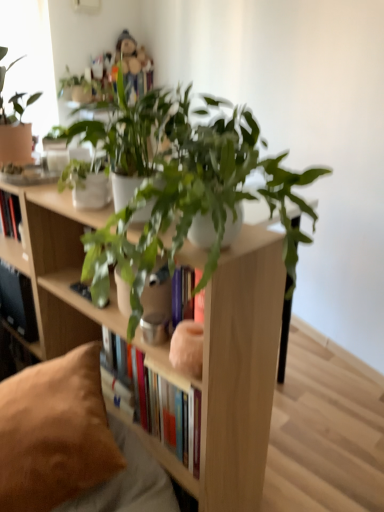
Question: From a real-world perspective, is black matte shelf at lower left located higher than green matte plant at center, the second houseplant from the front?

Choices:
 (A) no
 (B) yes

Answer: (A)

Question: Can you confirm if black matte shelf at lower left is shorter than green matte plant at center, the second houseplant from the front?

Choices:
 (A) yes
 (B) no

Answer: (A)

Question: Considering the relative sizes of black matte shelf at lower left and green matte plant at center, which is counted as the 1th houseplant, starting from the back, in the image provided, is black matte shelf at lower left bigger than green matte plant at center, which is counted as the 1th houseplant, starting from the back,?

Choices:
 (A) yes
 (B) no

Answer: (B)

Question: From the image's perspective, would you say black matte shelf at lower left is shown under green matte plant at center, the second houseplant from the front?

Choices:
 (A) yes
 (B) no

Answer: (A)

Question: Is black matte shelf at lower left far away from green matte plant at center, which is counted as the 1th houseplant, starting from the back?

Choices:
 (A) no
 (B) yes

Answer: (A)

Question: Considering the relative positions of matte white bookcase at center and black matte shelf at lower left in the image provided, is matte white bookcase at center to the left or to the right of black matte shelf at lower left?

Choices:
 (A) left
 (B) right

Answer: (B)

Question: Is matte white bookcase at center inside the boundaries of black matte shelf at lower left, or outside?

Choices:
 (A) inside
 (B) outside

Answer: (B)

Question: Relative to black matte shelf at lower left, is matte white bookcase at center in front or behind?

Choices:
 (A) front
 (B) behind

Answer: (A)

Question: From the image's perspective, is matte white bookcase at center positioned above or below black matte shelf at lower left?

Choices:
 (A) below
 (B) above

Answer: (A)

Question: Which is correct: green matte plant at center, which is counted as the 1th houseplant, starting from the back, is inside matte white bookcase at center, or outside of it?

Choices:
 (A) outside
 (B) inside

Answer: (A)

Question: From a real-world perspective, is green matte plant at center, the second houseplant from the front, physically located above or below matte white bookcase at center?

Choices:
 (A) above
 (B) below

Answer: (A)

Question: In the image, is green matte plant at center, which is counted as the 1th houseplant, starting from the back, positioned in front of or behind matte white bookcase at center?

Choices:
 (A) behind
 (B) front

Answer: (A)

Question: Based on their sizes in the image, would you say green matte plant at center, which is counted as the 1th houseplant, starting from the back, is bigger or smaller than matte white bookcase at center?

Choices:
 (A) small
 (B) big

Answer: (A)

Question: From the image's perspective, is black matte shelf at lower left located above or below matte glass window screen at upper left?

Choices:
 (A) below
 (B) above

Answer: (A)

Question: Considering the positions of point (24, 312) and point (43, 73), is point (24, 312) closer or farther from the camera than point (43, 73)?

Choices:
 (A) farther
 (B) closer

Answer: (B)